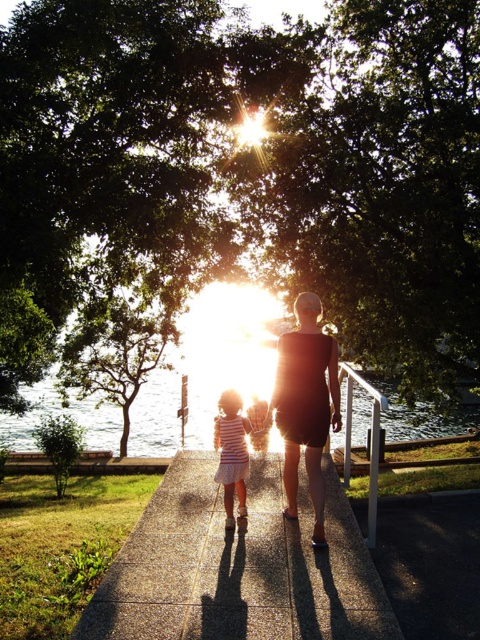
Which is behind, point (316, 460) or point (227, 444)?

The point (227, 444) is more distant.

Is black matte dress at center smaller than striped fabric dress at center?

Indeed, black matte dress at center has a smaller size compared to striped fabric dress at center.

Who is more forward, (290, 490) or (217, 424)?

Point (290, 490) is more forward.

Find the location of a particular element. black matte dress at center is located at coordinates (305, 404).

This screenshot has height=640, width=480. Describe the element at coordinates (239, 564) in the screenshot. I see `concrete sidewalk at center` at that location.

Is concrete sidewalk at center thinner than black matte dress at center?

In fact, concrete sidewalk at center might be wider than black matte dress at center.

Is point (237, 627) closer to camera compared to point (303, 349)?

That is True.

The image size is (480, 640). Identify the location of concrete sidewalk at center. (239, 564).

Can you confirm if concrete sidewalk at center is bigger than striped fabric dress at center?

Actually, concrete sidewalk at center might be smaller than striped fabric dress at center.

In the scene shown: Who is more forward, (204, 586) or (218, 440)?

Point (204, 586) is in front.

Between point (140, 557) and point (235, 410), which one is positioned behind?

The point (235, 410) is more distant.

This screenshot has height=640, width=480. Find the location of `concrete sidewalk at center`. concrete sidewalk at center is located at coordinates (239, 564).